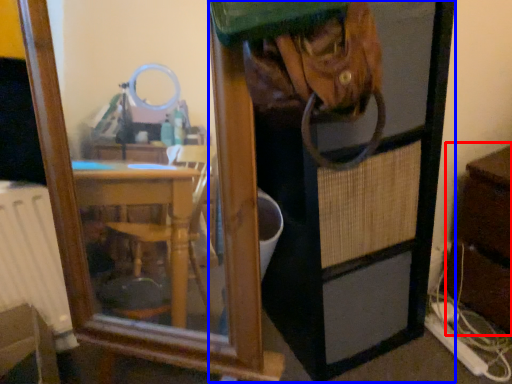
Question: Which point is closer to the camera, dresser (highlighted by a red box) or screen door (highlighted by a blue box)?

Choices:
 (A) dresser
 (B) screen door

Answer: (B)